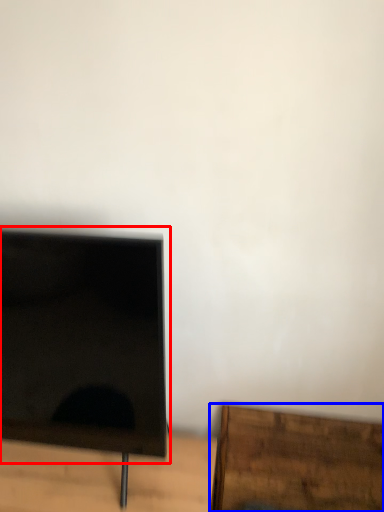
Question: Which of the following is the farthest to the observer, computer monitor (highlighted by a red box) or furniture (highlighted by a blue box)?

Choices:
 (A) computer monitor
 (B) furniture

Answer: (B)